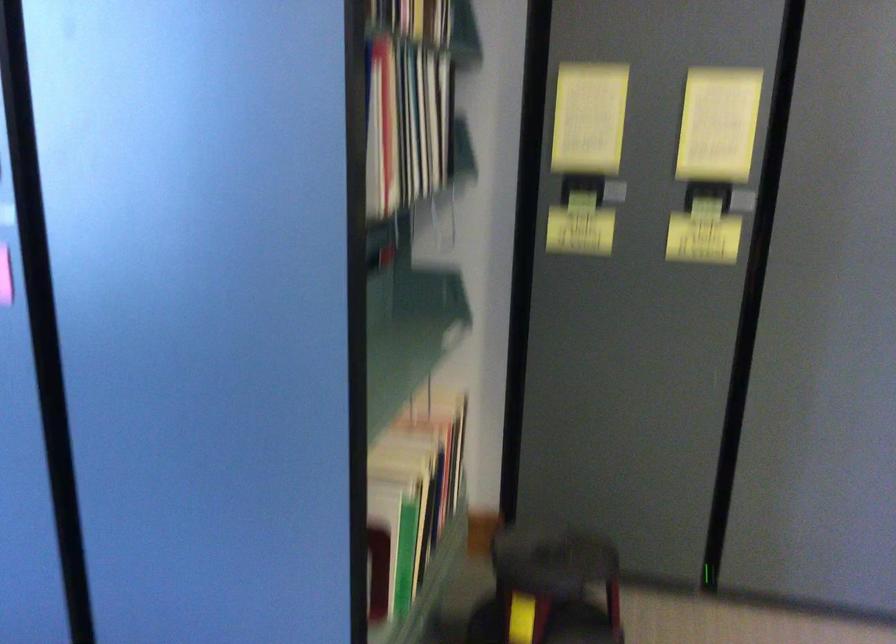
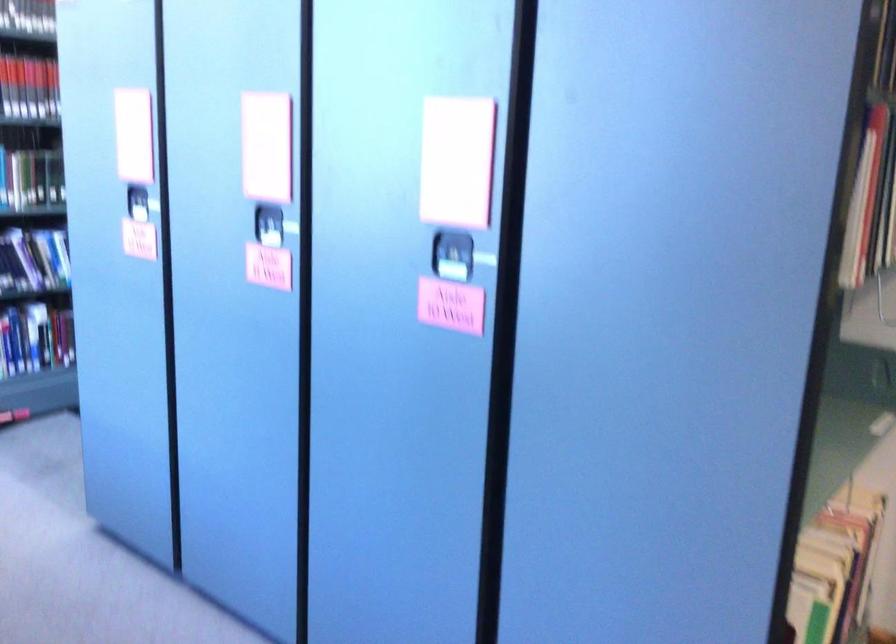
Question: The camera is either moving clockwise (left) or counter-clockwise (right) around the object. The first image is from the beginning of the video and the second image is from the end. Is the camera moving left or right when shooting the video?

Choices:
 (A) Left
 (B) Right

Answer: (B)